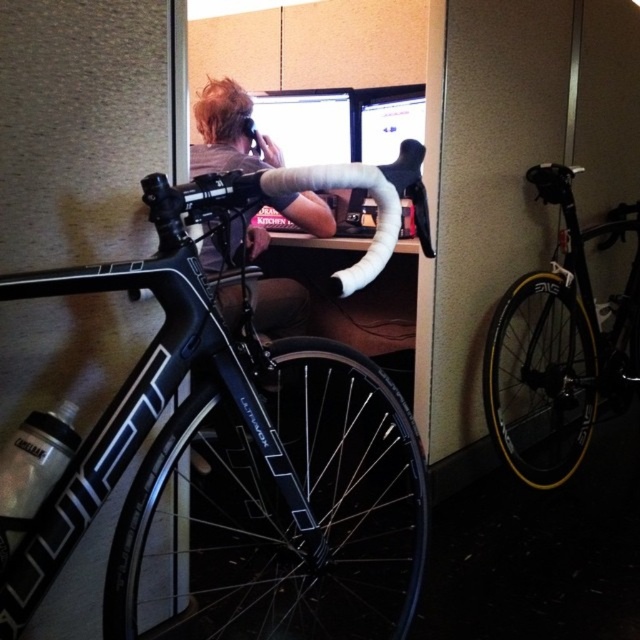
Question: In this image, where is black matte road bike at right located relative to blonde hair at upper center?

Choices:
 (A) right
 (B) left

Answer: (A)

Question: Can you confirm if black matte road bike at right is bigger than blonde hair at upper center?

Choices:
 (A) no
 (B) yes

Answer: (B)

Question: Which object is the closest to the black matte road bike at right?

Choices:
 (A) blonde hair at upper center
 (B) black matte road bike at center

Answer: (B)

Question: Which of the following is the farthest from the observer?

Choices:
 (A) blonde hair at upper center
 (B) black matte road bike at right
 (C) black matte road bike at center

Answer: (B)

Question: Does black matte road bike at center appear on the right side of blonde hair at upper center?

Choices:
 (A) no
 (B) yes

Answer: (B)

Question: Which point is farther from the camera taking this photo?

Choices:
 (A) (228, 296)
 (B) (621, 362)

Answer: (B)